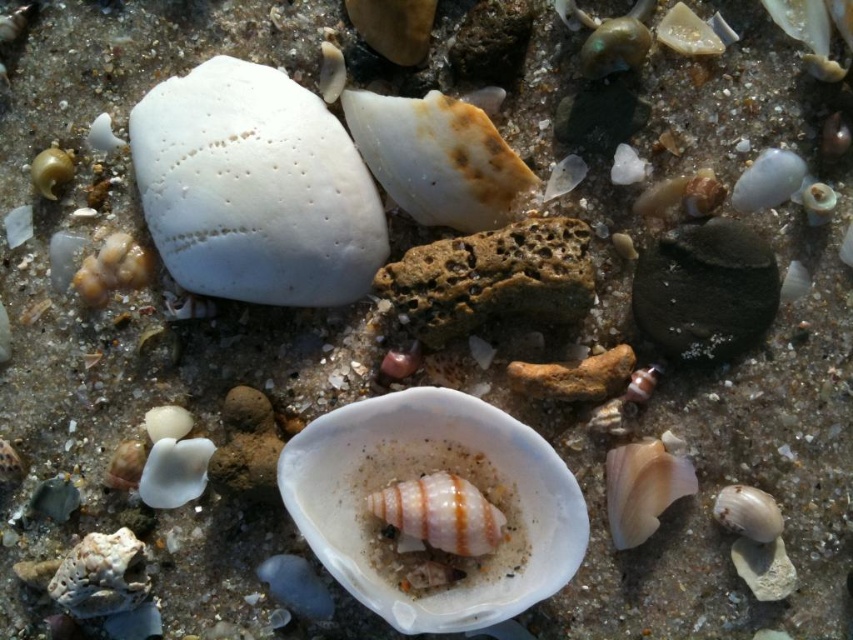
Question: Considering the real-world distances, which object is closest to the white glossy shell at center?

Choices:
 (A) pink glossy snail at center
 (B) white matte shell at upper left

Answer: (A)

Question: Which point appears closest to the camera in this image?

Choices:
 (A) (430, 397)
 (B) (260, 173)
 (C) (465, 486)

Answer: (C)

Question: Does white matte shell at upper left appear on the left side of pink glossy snail at center?

Choices:
 (A) yes
 (B) no

Answer: (A)

Question: Estimate the real-world distances between objects in this image. Which object is closer to the pink glossy snail at center?

Choices:
 (A) white matte shell at upper left
 (B) white glossy shell at center

Answer: (B)

Question: Considering the relative positions of white matte shell at upper left and pink glossy snail at center in the image provided, where is white matte shell at upper left located with respect to pink glossy snail at center?

Choices:
 (A) left
 (B) right

Answer: (A)

Question: Does white glossy shell at center have a lesser width compared to pink glossy snail at center?

Choices:
 (A) yes
 (B) no

Answer: (B)